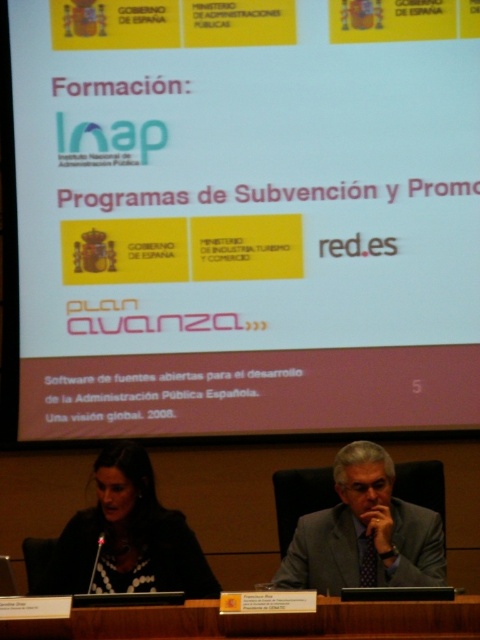
Is gray suit at center closer to the viewer compared to brown wood table at lower center?

No.

This screenshot has width=480, height=640. Find the location of `gray suit at center`. gray suit at center is located at coordinates (364, 532).

Between white matte projection screen at upper center and brown wood table at lower center, which one is positioned lower?

brown wood table at lower center is lower down.

Describe the element at coordinates (240, 216) in the screenshot. I see `white matte projection screen at upper center` at that location.

This screenshot has width=480, height=640. What do you see at coordinates (240, 216) in the screenshot? I see `white matte projection screen at upper center` at bounding box center [240, 216].

At what (x,y) coordinates should I click in order to perform the action: click on white matte projection screen at upper center. Please return your answer as a coordinate pair (x, y). The height and width of the screenshot is (640, 480). Looking at the image, I should click on (240, 216).

Between white matte projection screen at upper center and gray suit at center, which one has less height?

With less height is gray suit at center.

Who is taller, white matte projection screen at upper center or gray suit at center?

With more height is white matte projection screen at upper center.

This screenshot has width=480, height=640. In order to click on white matte projection screen at upper center in this screenshot , I will do `click(240, 216)`.

At what (x,y) coordinates should I click in order to perform the action: click on white matte projection screen at upper center. Please return your answer as a coordinate pair (x, y). The image size is (480, 640). Looking at the image, I should click on (240, 216).